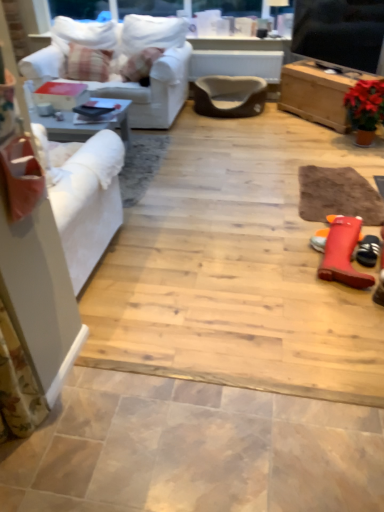
Question: Does matte ceramic tile at lower center, the 1th ceramic tile from the bottom, turn towards plaid fabric pillow at upper left?

Choices:
 (A) no
 (B) yes

Answer: (A)

Question: Can you confirm if matte ceramic tile at lower center, the 1th ceramic tile from the bottom, is smaller than plaid fabric pillow at upper left?

Choices:
 (A) no
 (B) yes

Answer: (B)

Question: From a real-world perspective, is matte ceramic tile at lower center, arranged as the second ceramic tile when viewed from the back, below plaid fabric pillow at upper left?

Choices:
 (A) no
 (B) yes

Answer: (B)

Question: Can you confirm if matte ceramic tile at lower center, the 1th ceramic tile from the bottom, is bigger than plaid fabric pillow at upper left?

Choices:
 (A) no
 (B) yes

Answer: (A)

Question: Is matte ceramic tile at lower center, arranged as the second ceramic tile when viewed from the back, behind plaid fabric pillow at upper left?

Choices:
 (A) yes
 (B) no

Answer: (B)

Question: From a real-world perspective, is natural stone tile at lower left, the second ceramic tile when ordered from front to back, above or below brown fabric pet bed at center, the first table from the left?

Choices:
 (A) below
 (B) above

Answer: (A)

Question: From the image's perspective, relative to brown fabric pet bed at center, acting as the second table starting from the right, is natural stone tile at lower left, the second ceramic tile when ordered from front to back, above or below?

Choices:
 (A) above
 (B) below

Answer: (B)

Question: Considering the positions of natural stone tile at lower left, the second ceramic tile when ordered from front to back, and brown fabric pet bed at center, acting as the second table starting from the right, in the image, is natural stone tile at lower left, the second ceramic tile when ordered from front to back, wider or thinner than brown fabric pet bed at center, acting as the second table starting from the right,?

Choices:
 (A) wide
 (B) thin

Answer: (A)

Question: Is natural stone tile at lower left, the first ceramic tile when ordered from back to front, taller or shorter than brown fabric pet bed at center, acting as the second table starting from the right?

Choices:
 (A) short
 (B) tall

Answer: (A)

Question: In the image, is brown fabric pet bed at center, acting as the second table starting from the right, positioned in front of or behind wooden chest at upper right, placed as the 2th table when sorted from left to right?

Choices:
 (A) behind
 (B) front

Answer: (A)

Question: Considering the positions of point (192, 61) and point (291, 92), is point (192, 61) closer or farther from the camera than point (291, 92)?

Choices:
 (A) closer
 (B) farther

Answer: (B)

Question: In the image, is brown fabric pet bed at center, acting as the second table starting from the right, on the left side or the right side of wooden chest at upper right, placed as the 2th table when sorted from left to right?

Choices:
 (A) right
 (B) left

Answer: (B)

Question: From the image's perspective, is brown fabric pet bed at center, acting as the second table starting from the right, above or below wooden chest at upper right, placed as the 2th table when sorted from left to right?

Choices:
 (A) below
 (B) above

Answer: (B)

Question: Considering the positions of point (327, 253) and point (274, 79), is point (327, 253) closer or farther from the camera than point (274, 79)?

Choices:
 (A) farther
 (B) closer

Answer: (B)

Question: From a real-world perspective, relative to brown fabric pet bed at center, acting as the second table starting from the right, is rubber boot at lower right, the 1th footwear when ordered from left to right, vertically above or below?

Choices:
 (A) below
 (B) above

Answer: (A)